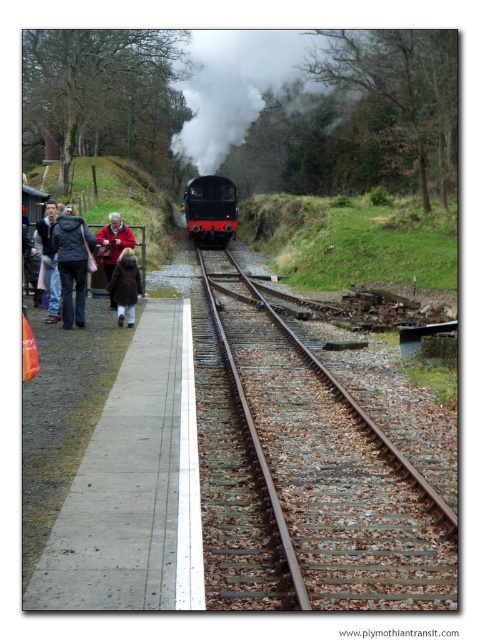
You are standing on the platform at the railway station and see the brown metal track at center and the dark gray jacket at left. Which object is positioned lower from your viewpoint?

The brown metal track at center is positioned lower than the dark gray jacket at left from your viewpoint.

You are a passenger on the platform waiting for the train. You notice two people wearing dark blue jacket at left and red woolen sweater at left. Which one is positioned more to the left side of the platform?

The dark blue jacket at left is positioned more to the left side of the platform than the red woolen sweater at left.

You are standing at the point labeled point (216, 168) and want to walk to the point labeled point (71, 316). Given the layout of the railway station, will you have to cross the tracks to reach your destination?

Since point (216, 168) is behind point (71, 316), you would not need to cross the tracks to reach your destination as they are aligned along the same path behind the tracks.